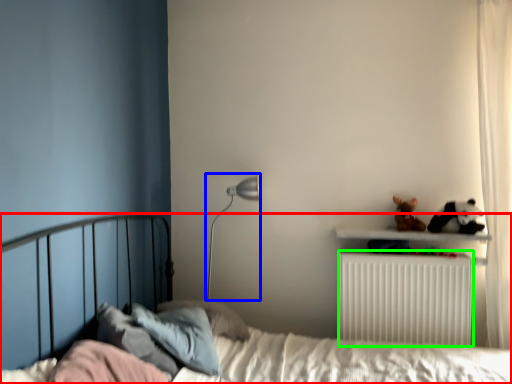
Question: Based on their relative distances, which object is farther from bed (highlighted by a red box)? Choose from table lamp (highlighted by a blue box) and radiator (highlighted by a green box).

Choices:
 (A) table lamp
 (B) radiator

Answer: (A)